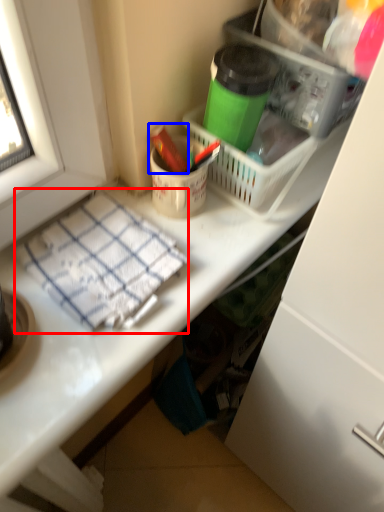
Question: Which of the following is the closest to the observer, blanket (highlighted by a red box) or crayon (highlighted by a blue box)?

Choices:
 (A) blanket
 (B) crayon

Answer: (A)